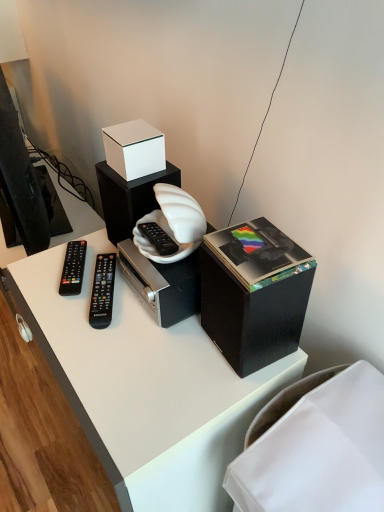
Question: Does black plastic remote at center, placed as the 2th remote control when sorted from left to right, have a greater height compared to black plastic remote at left, the first remote control viewed from the left?

Choices:
 (A) no
 (B) yes

Answer: (B)

Question: Can you confirm if black plastic remote at center, the first remote control from the right, is positioned to the right of black plastic remote at left, marked as the 2th remote control in a right-to-left arrangement?

Choices:
 (A) yes
 (B) no

Answer: (A)

Question: Is black plastic remote at center, the first remote control from the right, looking in the opposite direction of black plastic remote at left, the first remote control viewed from the left?

Choices:
 (A) no
 (B) yes

Answer: (A)

Question: Can you confirm if black plastic remote at center, the first remote control from the right, is thinner than black plastic remote at left, the first remote control viewed from the left?

Choices:
 (A) yes
 (B) no

Answer: (B)

Question: Could you tell me if black plastic remote at center, the first remote control from the right, is facing black plastic remote at left, marked as the 2th remote control in a right-to-left arrangement?

Choices:
 (A) yes
 (B) no

Answer: (A)

Question: From a real-world perspective, relative to white matte box at upper center, is black plastic remote at center, the first remote control from the right, vertically above or below?

Choices:
 (A) above
 (B) below

Answer: (B)

Question: Considering their positions, is black plastic remote at center, the first remote control from the right, located in front of or behind white matte box at upper center?

Choices:
 (A) front
 (B) behind

Answer: (B)

Question: From the image's perspective, is black plastic remote at center, the first remote control from the right, above or below white matte box at upper center?

Choices:
 (A) below
 (B) above

Answer: (A)

Question: Is black plastic remote at center, the first remote control from the right, bigger or smaller than white matte box at upper center?

Choices:
 (A) big
 (B) small

Answer: (B)

Question: Is white matte speaker at center inside the boundaries of black plastic remote at left, the first remote control viewed from the left, or outside?

Choices:
 (A) inside
 (B) outside

Answer: (B)

Question: From the image's perspective, is white matte speaker at center above or below black plastic remote at left, marked as the 2th remote control in a right-to-left arrangement?

Choices:
 (A) above
 (B) below

Answer: (A)

Question: Is white matte speaker at center bigger or smaller than black plastic remote at left, the first remote control viewed from the left?

Choices:
 (A) big
 (B) small

Answer: (A)

Question: Considering the positions of white matte speaker at center and black plastic remote at left, marked as the 2th remote control in a right-to-left arrangement, in the image, is white matte speaker at center taller or shorter than black plastic remote at left, marked as the 2th remote control in a right-to-left arrangement,?

Choices:
 (A) short
 (B) tall

Answer: (B)

Question: Looking at their shapes, would you say black plastic remote at left, the first remote control viewed from the left, is wider or thinner than white matte speaker at center?

Choices:
 (A) thin
 (B) wide

Answer: (A)

Question: From the image's perspective, is black plastic remote at left, marked as the 2th remote control in a right-to-left arrangement, located above or below white matte speaker at center?

Choices:
 (A) below
 (B) above

Answer: (A)